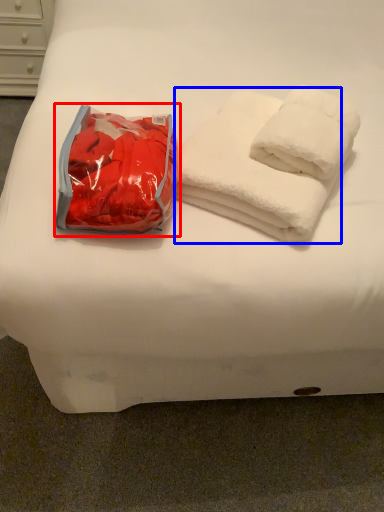
Question: Which object is further to the camera taking this photo, bean bag chair (highlighted by a red box) or towel (highlighted by a blue box)?

Choices:
 (A) bean bag chair
 (B) towel

Answer: (B)